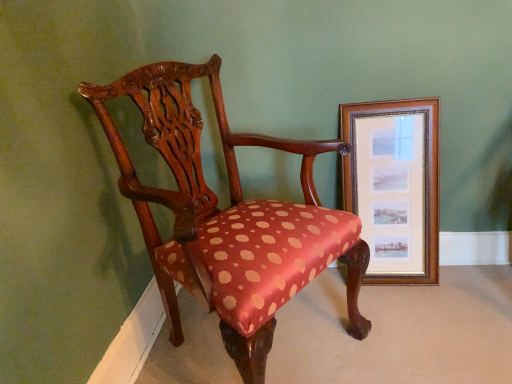
Find the location of `free point below polished wood chair at center (from a real-world perspective)`. free point below polished wood chair at center (from a real-world perspective) is located at coordinates pyautogui.click(x=284, y=340).